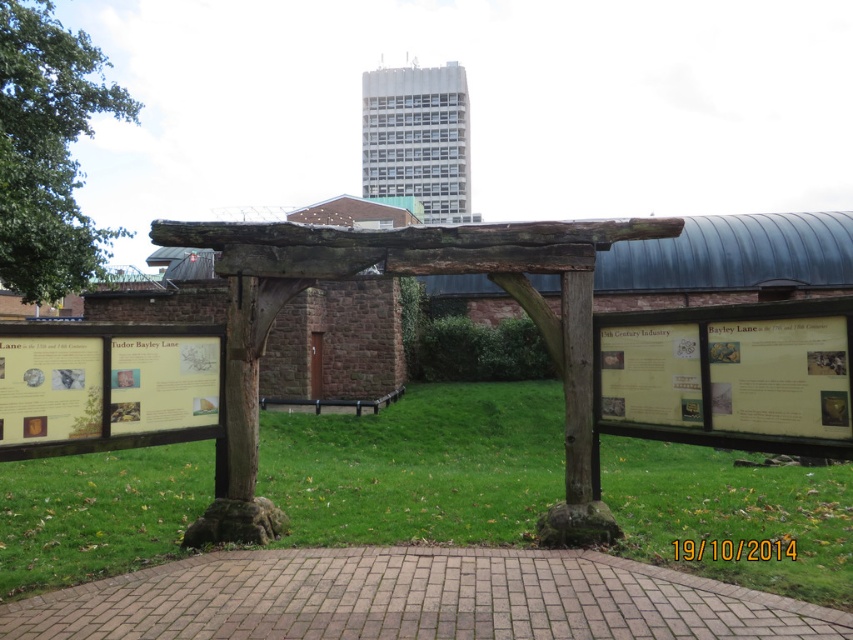
Can you confirm if weathered wood arch at center is positioned above brown wooden pergola at upper center?

No, weathered wood arch at center is not above brown wooden pergola at upper center.

Between point (271, 230) and point (392, 99), which one is positioned in front?

Point (271, 230) is in front.

Image resolution: width=853 pixels, height=640 pixels. I want to click on weathered wood arch at center, so click(x=451, y=269).

Where is `weathered wood arch at center`? The image size is (853, 640). weathered wood arch at center is located at coordinates (x=451, y=269).

Between brick paved path at center and weathered wood arch at center, which one appears on the right side from the viewer's perspective?

From the viewer's perspective, weathered wood arch at center appears more on the right side.

Between brick paved path at center and weathered wood arch at center, which one is positioned higher?

weathered wood arch at center

Between point (346, 621) and point (230, 228), which one is positioned in front?

Point (346, 621) is in front.

The width and height of the screenshot is (853, 640). In order to click on brick paved path at center in this screenshot , I will do `click(415, 598)`.

Is brick paved path at center behind brown wooden pergola at upper center?

No, it is not.

Is brick paved path at center below brown wooden pergola at upper center?

Indeed, brick paved path at center is positioned under brown wooden pergola at upper center.

Is point (296, 563) more distant than point (437, 180)?

No, (296, 563) is in front of (437, 180).

I want to click on brick paved path at center, so click(x=415, y=598).